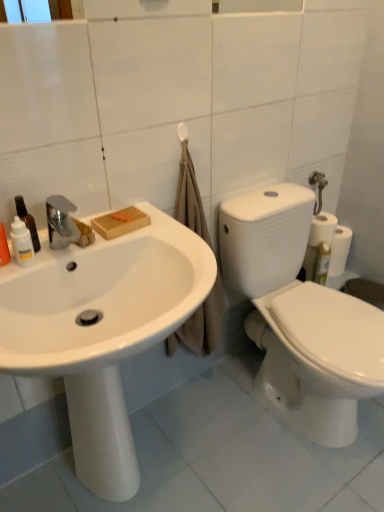
Question: From a real-world perspective, is white matte towel bar at upper center positioned under white glossy bottle at left based on gravity?

Choices:
 (A) yes
 (B) no

Answer: (B)

Question: Is white glossy bottle at left located within white matte towel bar at upper center?

Choices:
 (A) yes
 (B) no

Answer: (B)

Question: Can you confirm if white matte towel bar at upper center is positioned to the right of white glossy bottle at left?

Choices:
 (A) yes
 (B) no

Answer: (A)

Question: Is white matte towel bar at upper center touching white glossy bottle at left?

Choices:
 (A) no
 (B) yes

Answer: (A)

Question: Is there a large distance between white matte towel bar at upper center and white glossy bottle at left?

Choices:
 (A) no
 (B) yes

Answer: (A)

Question: From their relative heights in the image, would you say translucent plastic bottle at left, positioned as the first cleaning product in right-to-left order, is taller or shorter than white glossy sink at left?

Choices:
 (A) short
 (B) tall

Answer: (A)

Question: Looking at the image, does translucent plastic bottle at left, positioned as the first cleaning product in right-to-left order, seem bigger or smaller compared to white glossy sink at left?

Choices:
 (A) small
 (B) big

Answer: (A)

Question: Does point (38, 245) appear closer or farther from the camera than point (29, 331)?

Choices:
 (A) closer
 (B) farther

Answer: (B)

Question: From a real-world perspective, is translucent plastic bottle at left, positioned as the first cleaning product in right-to-left order, physically located above or below white glossy sink at left?

Choices:
 (A) above
 (B) below

Answer: (A)

Question: Is white glossy sink at left taller or shorter than translucent plastic bottle at left, which ranks as the second cleaning product in left-to-right order?

Choices:
 (A) tall
 (B) short

Answer: (A)

Question: Does point (92, 333) appear closer or farther from the camera than point (31, 224)?

Choices:
 (A) closer
 (B) farther

Answer: (A)

Question: In the image, is white glossy sink at left positioned in front of or behind translucent plastic bottle at left, which ranks as the second cleaning product in left-to-right order?

Choices:
 (A) behind
 (B) front

Answer: (B)

Question: Visually, is white glossy sink at left positioned to the left or to the right of translucent plastic bottle at left, positioned as the first cleaning product in right-to-left order?

Choices:
 (A) right
 (B) left

Answer: (A)

Question: Is translucent plastic spray bottle at left, which is counted as the 1th cleaning product, starting from the left, wider or thinner than white glossy bottle at left?

Choices:
 (A) wide
 (B) thin

Answer: (A)

Question: Visually, is translucent plastic spray bottle at left, which appears as the second cleaning product when viewed from the right, positioned to the left or to the right of white glossy bottle at left?

Choices:
 (A) right
 (B) left

Answer: (B)